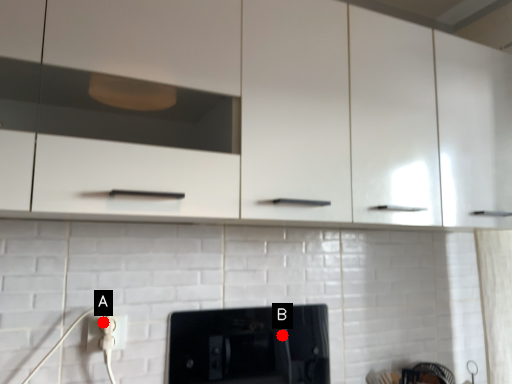
Question: Two points are circled on the image, labeled by A and B beside each circle. Which point is closer to the camera?

Choices:
 (A) A is closer
 (B) B is closer

Answer: (A)